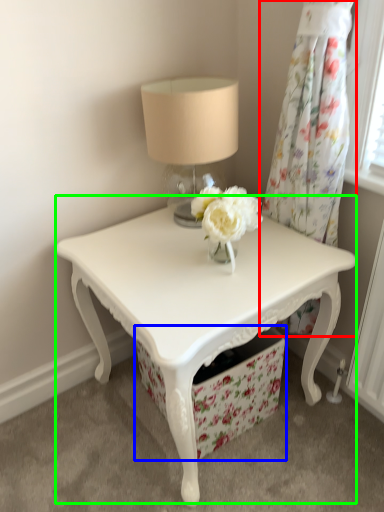
Question: Estimate the real-world distances between objects in this image. Which object is closer to curtain (highlighted by a red box), drawer (highlighted by a blue box) or table (highlighted by a green box)?

Choices:
 (A) drawer
 (B) table

Answer: (B)